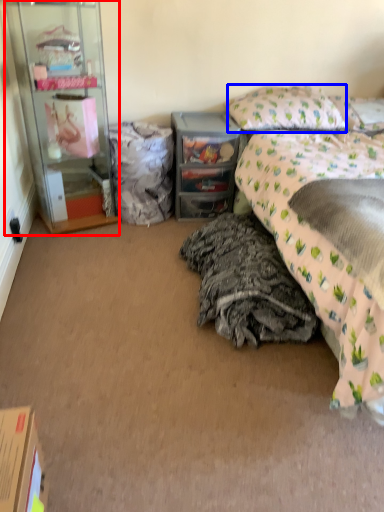
Question: Among these objects, which one is farthest to the camera, cabinetry (highlighted by a red box) or pillow (highlighted by a blue box)?

Choices:
 (A) cabinetry
 (B) pillow

Answer: (B)